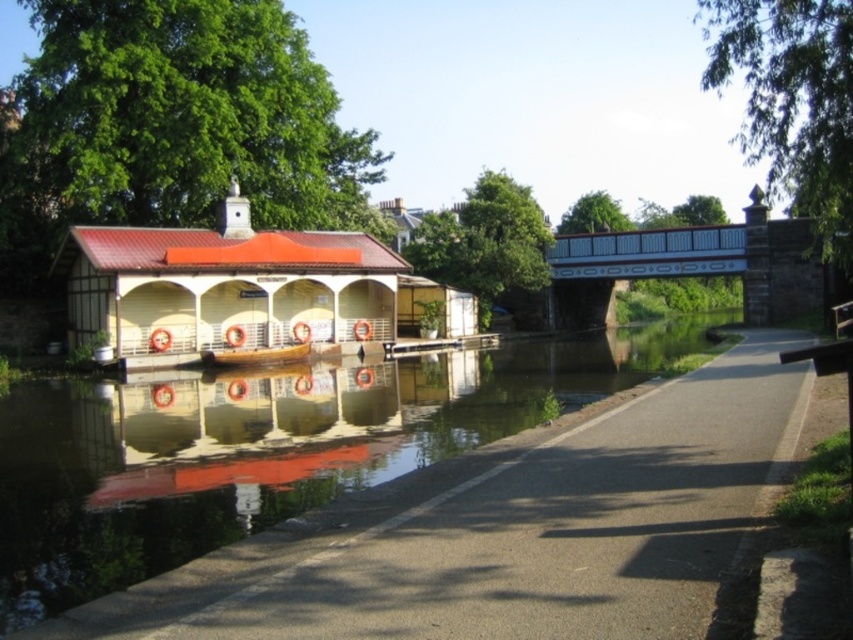
Question: Among these points, which one is farthest from the camera?

Choices:
 (A) (267, 308)
 (B) (49, 552)

Answer: (A)

Question: Which of the following is the closest to the observer?

Choices:
 (A) (235, 355)
 (B) (239, 243)
 (C) (206, 508)

Answer: (C)

Question: Which of the following is the closest to the observer?

Choices:
 (A) coord(242,362)
 (B) coord(1,524)
 (C) coord(338,280)

Answer: (B)

Question: Does matte white hut at left have a greater width compared to wooden boat at center?

Choices:
 (A) yes
 (B) no

Answer: (A)

Question: Does matte white hut at left appear under wooden boat at center?

Choices:
 (A) yes
 (B) no

Answer: (B)

Question: Does smooth concrete river at center have a smaller size compared to matte white hut at left?

Choices:
 (A) no
 (B) yes

Answer: (A)